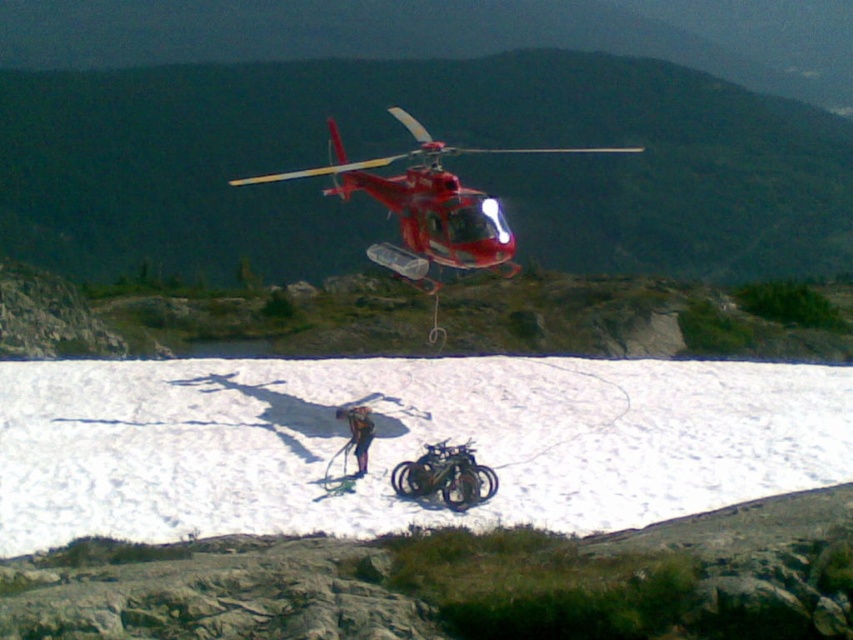
Does white powder snow at center have a greater height compared to shiny red helicopter at center?

No.

Does point (338, 506) lie behind point (480, 205)?

No.

This screenshot has height=640, width=853. I want to click on white powder snow at center, so click(402, 442).

Is white powder snow at center smaller than brown leather jacket at center?

Actually, white powder snow at center might be larger than brown leather jacket at center.

Is point (299, 442) positioned in front of point (363, 474)?

No, it is behind (363, 474).

I want to click on white powder snow at center, so click(x=402, y=442).

Does shiny red helicopter at center have a smaller size compared to shiny metallic motorcycle at center?

Actually, shiny red helicopter at center might be larger than shiny metallic motorcycle at center.

Is shiny red helicopter at center to the left of shiny metallic motorcycle at center from the viewer's perspective?

No, shiny red helicopter at center is not to the left of shiny metallic motorcycle at center.

Where is `shiny red helicopter at center`? The height and width of the screenshot is (640, 853). shiny red helicopter at center is located at coordinates (427, 205).